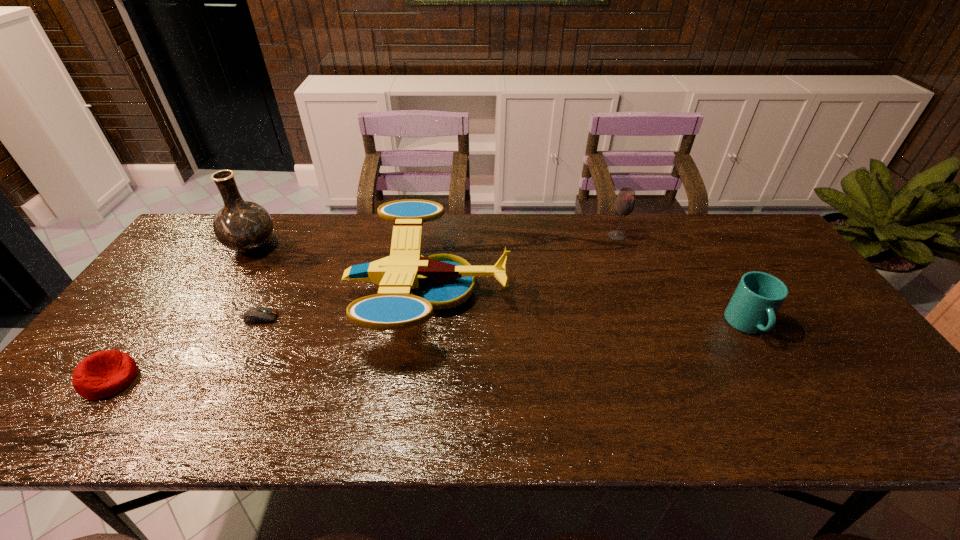
Where is `vacant space located 0.110m on the left of the glass drink container`? The width and height of the screenshot is (960, 540). vacant space located 0.110m on the left of the glass drink container is located at coordinates (574, 236).

Locate an element on the screen. This screenshot has width=960, height=540. vacant region located at the cockpit of the drone is located at coordinates (533, 291).

The image size is (960, 540). What are the coordinates of `free space located 0.160m on the handle side of the rightmost object` in the screenshot? It's located at (794, 403).

Where is `free point located on the seat area of the fifth tallest object`? The height and width of the screenshot is (540, 960). free point located on the seat area of the fifth tallest object is located at coordinates (170, 380).

Locate an element on the screen. This screenshot has width=960, height=540. vacant space located on the button of the shortest object is located at coordinates (345, 318).

The height and width of the screenshot is (540, 960). In order to click on vase that is positioned at the far edge in this screenshot , I will do `click(242, 226)`.

Identify the location of glass drink container that is at the far edge. (624, 204).

Where is `drone situated at the far edge`? Image resolution: width=960 pixels, height=540 pixels. drone situated at the far edge is located at coordinates (410, 286).

This screenshot has width=960, height=540. Find the location of `object that is at the near edge`. object that is at the near edge is located at coordinates (103, 374).

This screenshot has height=540, width=960. Identify the location of vase positioned at the left edge. (242, 226).